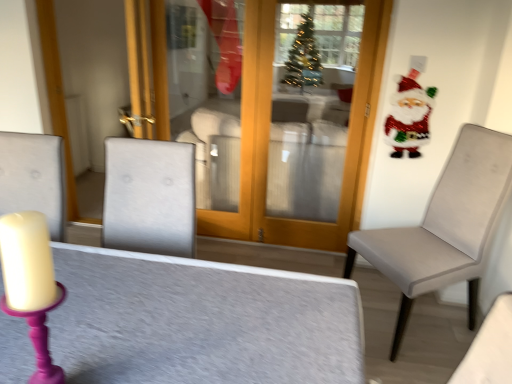
Image resolution: width=512 pixels, height=384 pixels. I want to click on matte gray chair at right, so click(444, 226).

This screenshot has width=512, height=384. What do you see at coordinates (409, 116) in the screenshot?
I see `shiny sequined santa at upper right` at bounding box center [409, 116].

What is the approximate height of shiny sequined santa at upper right?

21.44 inches.

Locate an element on the screen. This screenshot has width=512, height=384. matte gray chair at right is located at coordinates (444, 226).

Image resolution: width=512 pixels, height=384 pixels. What are the coordinates of `table that is below the matte gray chair at right (from the image's perspective)` in the screenshot? It's located at (200, 321).

Is textured gray table at center facing away from matte gray chair at right?

That's not correct — textured gray table at center is not looking away from matte gray chair at right.

Which is more to the left, textured gray table at center or matte gray chair at right?

textured gray table at center.

From a real-world perspective, is textured gray table at center located higher than matte gray chair at right?

No, from a real-world perspective, textured gray table at center is not above matte gray chair at right.

Is textured gray table at center far from shiny sequined santa at upper right?

Absolutely, textured gray table at center is distant from shiny sequined santa at upper right.

Which is nearer, [328,348] or [421,127]?

Clearly, point [328,348] is closer to the camera than point [421,127].

Considering the relative positions of textured gray table at center and shiny sequined santa at upper right in the image provided, is textured gray table at center to the right of shiny sequined santa at upper right from the viewer's perspective?

Incorrect, textured gray table at center is not on the right side of shiny sequined santa at upper right.

Would you say textured gray table at center is inside or outside shiny sequined santa at upper right?

textured gray table at center exists outside the volume of shiny sequined santa at upper right.

In the image, there is a shiny sequined santa at upper right. In order to click on chair below it (from the image's perspective) in this screenshot , I will do click(x=444, y=226).

Looking at this image, does matte gray chair at right lie in front of shiny sequined santa at upper right?

Yes, it is in front of shiny sequined santa at upper right.

Considering the points (433, 253) and (415, 77), which point is behind, point (433, 253) or point (415, 77)?

Point (415, 77)

Between matte gray chair at right and shiny sequined santa at upper right, which one appears on the right side from the viewer's perspective?

From the viewer's perspective, shiny sequined santa at upper right appears more on the right side.

The width and height of the screenshot is (512, 384). What are the coordinates of `chair on the right of textured gray table at center` in the screenshot? It's located at (444, 226).

Which is in front, point (384, 234) or point (125, 378)?

Point (125, 378)

Could you tell me if matte gray chair at right is facing textured gray table at center?

Yes, matte gray chair at right is facing textured gray table at center.

From the image's perspective, is shiny sequined santa at upper right below matte gray chair at right?

No.

Would you say shiny sequined santa at upper right is inside or outside matte gray chair at right?

shiny sequined santa at upper right lies outside matte gray chair at right.

Which object is further away from the camera taking this photo, shiny sequined santa at upper right or matte gray chair at right?

shiny sequined santa at upper right is more distant.

Where is `santa claus lying above the matte gray chair at right (from the image's perspective)`? The width and height of the screenshot is (512, 384). santa claus lying above the matte gray chair at right (from the image's perspective) is located at coordinates tap(409, 116).

At what (x,y) coordinates should I click in order to perform the action: click on santa claus above the textured gray table at center (from the image's perspective). Please return your answer as a coordinate pair (x, y). Looking at the image, I should click on (409, 116).

Which object is positioned more to the right, shiny sequined santa at upper right or textured gray table at center?

From the viewer's perspective, shiny sequined santa at upper right appears more on the right side.

Considering the positions of points (408, 139) and (99, 286), is point (408, 139) farther from camera compared to point (99, 286)?

That is True.

Is shiny sequined santa at upper right looking in the opposite direction of textured gray table at center?

shiny sequined santa at upper right does not have its back to textured gray table at center.

I want to click on chair behind the textured gray table at center, so click(444, 226).

This screenshot has height=384, width=512. I want to click on santa claus above the textured gray table at center (from a real-world perspective), so click(x=409, y=116).

Based on their spatial positions, is textured gray table at center or shiny sequined santa at upper right further from matte gray chair at right?

textured gray table at center lies further to matte gray chair at right than the other object.

Based on their spatial positions, is textured gray table at center or matte gray chair at right further from shiny sequined santa at upper right?

The object further to shiny sequined santa at upper right is textured gray table at center.

When comparing their distances from matte gray chair at right, does shiny sequined santa at upper right or textured gray table at center seem closer?

shiny sequined santa at upper right lies closer to matte gray chair at right than the other object.

Estimate the real-world distances between objects in this image. Which object is closer to textured gray table at center, matte gray chair at right or shiny sequined santa at upper right?

The object closer to textured gray table at center is matte gray chair at right.

From the image, which object appears to be farther from textured gray table at center, shiny sequined santa at upper right or matte gray chair at right?

shiny sequined santa at upper right.

Based on their spatial positions, is matte gray chair at right or textured gray table at center closer to shiny sequined santa at upper right?

matte gray chair at right is positioned closer to the anchor shiny sequined santa at upper right.

Find the location of a particular element. This screenshot has width=512, height=384. chair between textured gray table at center and shiny sequined santa at upper right from left to right is located at coordinates (444, 226).